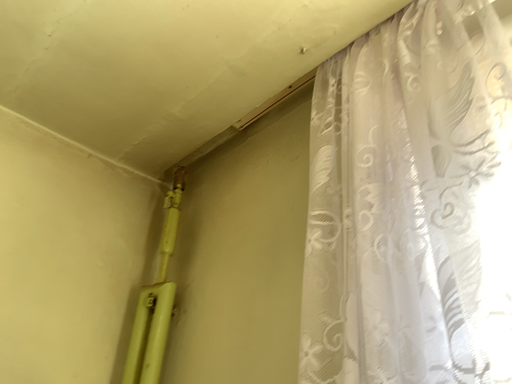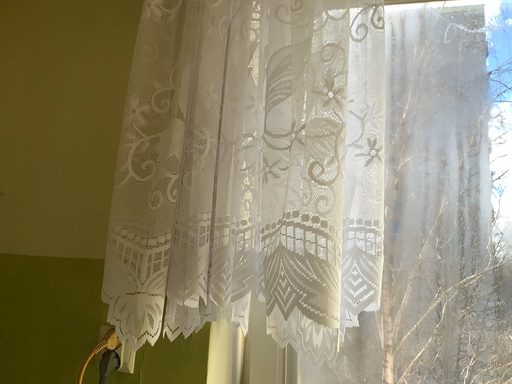
Question: How did the camera likely rotate when shooting the video?

Choices:
 (A) rotated left
 (B) rotated right

Answer: (B)